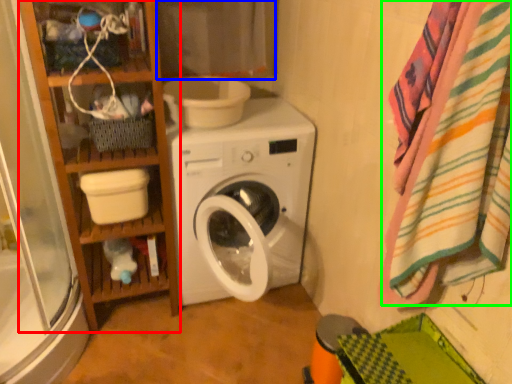
Question: Which is nearer to the bookshelf (highlighted by a red box)? curtain (highlighted by a blue box) or bath towel (highlighted by a green box).

Choices:
 (A) curtain
 (B) bath towel

Answer: (A)